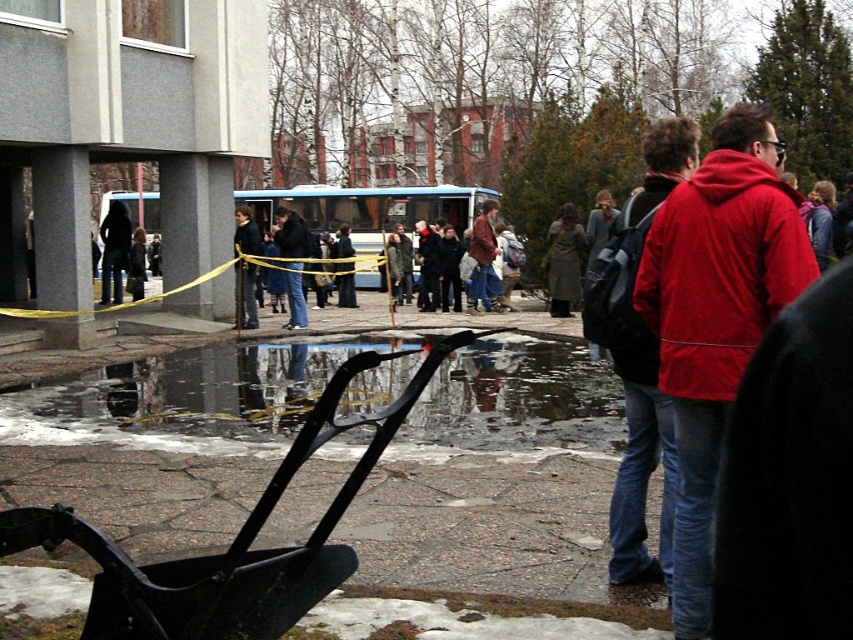
Is jeans at center bigger than dark blue jeans at center?

Incorrect, jeans at center is not larger than dark blue jeans at center.

Is jeans at center thinner than dark blue jeans at center?

Indeed, jeans at center has a lesser width compared to dark blue jeans at center.

The width and height of the screenshot is (853, 640). What do you see at coordinates (292, 262) in the screenshot?
I see `jeans at center` at bounding box center [292, 262].

You are a GUI agent. You are given a task and a screenshot of the screen. Output one action in this format:
    pyautogui.click(x=<x>, y=<y>)
    Task: Click on the jeans at center
    The image size is (853, 640).
    Given the screenshot: What is the action you would take?
    pyautogui.click(x=292, y=262)

Which is above, black plastic baby carriage at lower center or dark blue jeans at center?

Positioned higher is dark blue jeans at center.

I want to click on black plastic baby carriage at lower center, so click(234, 538).

Which is in front, point (724, 333) or point (238, 323)?

Point (724, 333) is more forward.

Between red matte jacket at center and dark blue jeans at center, which one is positioned higher?

dark blue jeans at center

The height and width of the screenshot is (640, 853). What do you see at coordinates (717, 317) in the screenshot?
I see `red matte jacket at center` at bounding box center [717, 317].

Find the location of `red matte jacket at center`. red matte jacket at center is located at coordinates (717, 317).